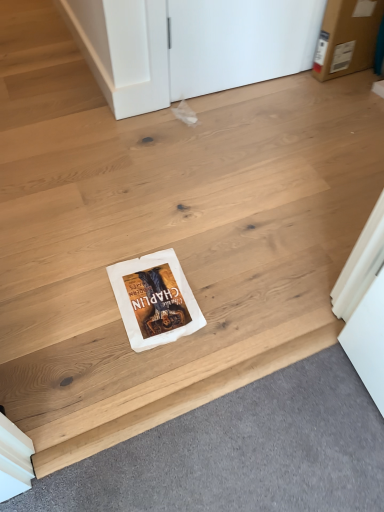
Locate an element on the screen. This screenshot has width=384, height=512. blank space situated above white matte book at center (from a real-world perspective) is located at coordinates (198, 388).